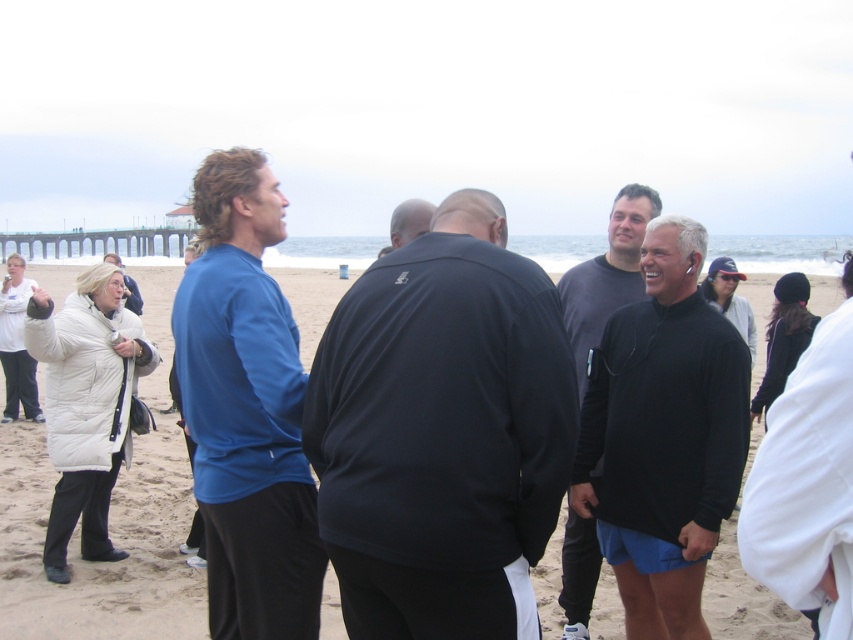
You are a photographer trying to capture a group photo of the blue fleece jacket at center and the black matte shirt at right. Since you want to include both subjects in the frame, which direction should you move to ensure both are visible?

Since the blue fleece jacket at center is to the left of the black matte shirt at right, you should move to the left to ensure both subjects are visible in the frame.

Based on the photo, you are a photographer trying to capture a group photo of the matte black jacket at center and the blue fleece jacket at center. Since you want to emphasize the size difference between them, which jacket should you position closer to the camera to make it appear bigger?

To emphasize the size difference, position the smaller blue fleece jacket at center closer to the camera. Since the matte black jacket at center is already larger in size, placing the smaller one closer can create a visual contrast where the blue fleece jacket at center appears bigger in the frame while the matte black jacket at center remains naturally larger, enhancing the size contrast.

Based on the photo, you are standing at the position of point (219, 348) and want to walk towards the ocean. Is the point (357, 424) blocking your path?

Point (357, 424) is in front of point (219, 348), so yes, it is blocking your path.